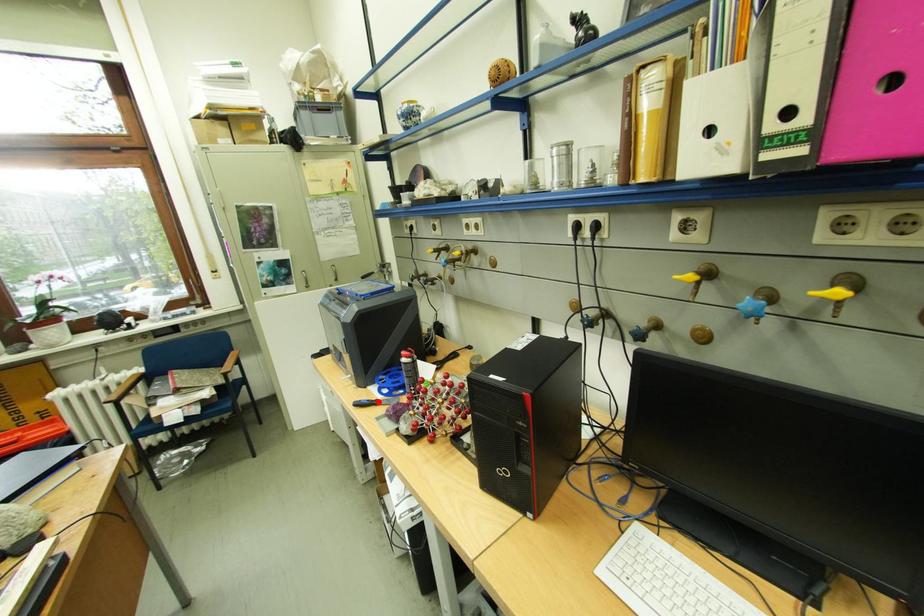
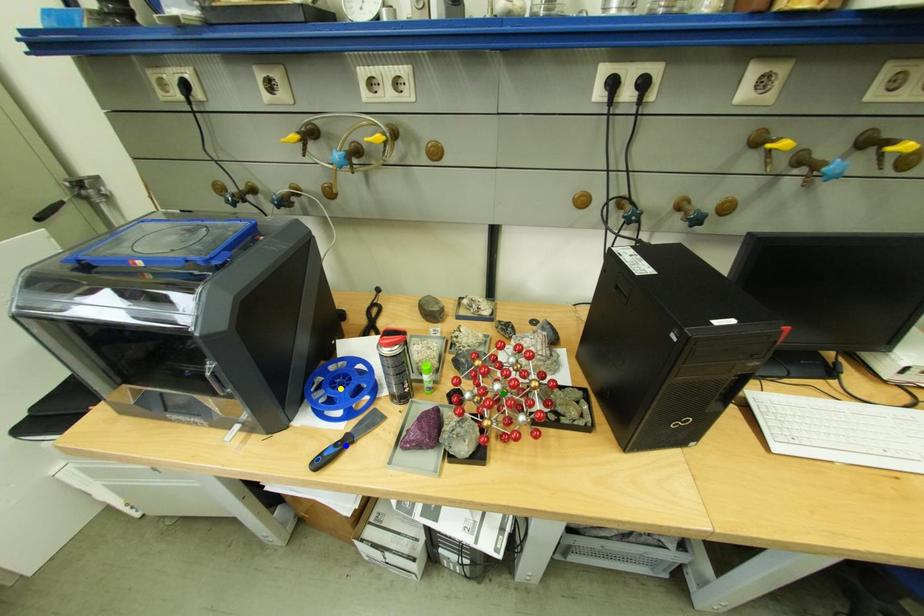
Question: I am providing you with two images of the same scene from different viewpoints. A red point is marked on the first image. You are given multiple points on the second image. Which spot in image 2 lines up with the point in image 1?

Choices:
 (A) blue point
 (B) yellow point
 (C) green point

Answer: (A)